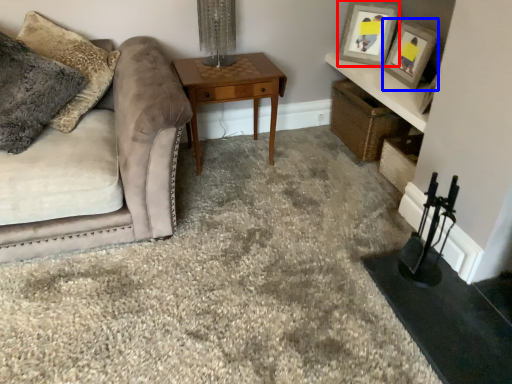
Question: Which point is further to the camera, picture frame (highlighted by a red box) or picture frame (highlighted by a blue box)?

Choices:
 (A) picture frame
 (B) picture frame

Answer: (A)